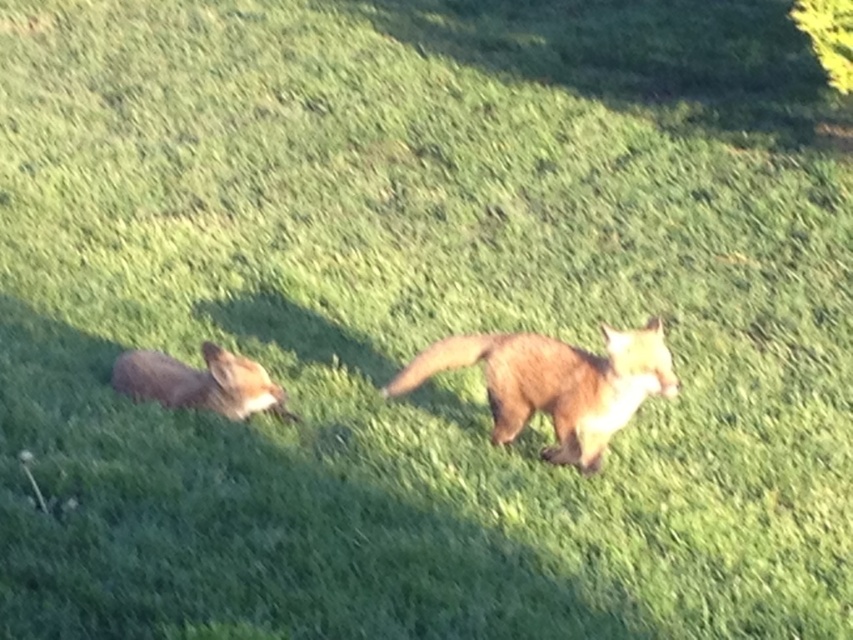
Question: Is brown furry fox at center wider than fluffy reddish-brown fox at left?

Choices:
 (A) no
 (B) yes

Answer: (B)

Question: From the image, what is the correct spatial relationship of brown furry fox at center in relation to fluffy reddish-brown fox at left?

Choices:
 (A) left
 (B) right

Answer: (B)

Question: Is brown furry fox at center positioned behind fluffy reddish-brown fox at left?

Choices:
 (A) yes
 (B) no

Answer: (B)

Question: Which point is farther to the camera?

Choices:
 (A) brown furry fox at center
 (B) fluffy reddish-brown fox at left

Answer: (B)